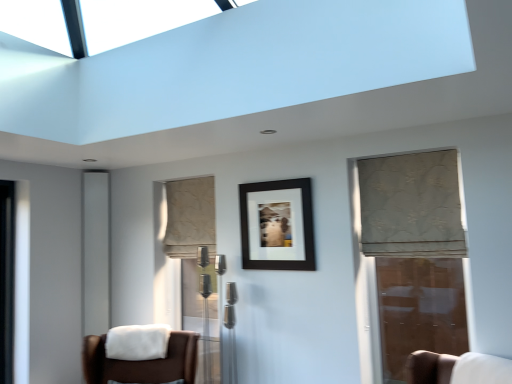
Question: Is white soft fabric at lower left positioned with its back to beige floral fabric curtain at right, arranged as the 1th curtain when viewed from the front?

Choices:
 (A) no
 (B) yes

Answer: (A)

Question: Considering the relative sizes of white soft fabric at lower left and beige floral fabric curtain at right, the second curtain in the left-to-right sequence, in the image provided, is white soft fabric at lower left bigger than beige floral fabric curtain at right, the second curtain in the left-to-right sequence,?

Choices:
 (A) yes
 (B) no

Answer: (B)

Question: Does white soft fabric at lower left have a lesser height compared to beige floral fabric curtain at right, arranged as the 1th curtain when viewed from the front?

Choices:
 (A) no
 (B) yes

Answer: (B)

Question: Could you tell me if white soft fabric at lower left is turned towards beige floral fabric curtain at right, positioned as the first curtain in right-to-left order?

Choices:
 (A) no
 (B) yes

Answer: (A)

Question: Is the depth of white soft fabric at lower left greater than that of beige floral fabric curtain at right, arranged as the 1th curtain when viewed from the front?

Choices:
 (A) no
 (B) yes

Answer: (B)

Question: From a real-world perspective, is white soft fabric at lower left on beige floral fabric curtain at right, the 2th curtain when ordered from back to front?

Choices:
 (A) yes
 (B) no

Answer: (B)

Question: From a real-world perspective, is brown leather chair at lower left, placed as the 1th chair when sorted from left to right, below transparent glass door at right?

Choices:
 (A) yes
 (B) no

Answer: (A)

Question: Can you confirm if brown leather chair at lower left, which ranks as the 2th chair in right-to-left order, is positioned to the right of transparent glass door at right?

Choices:
 (A) no
 (B) yes

Answer: (A)

Question: Does brown leather chair at lower left, which ranks as the 2th chair in right-to-left order, have a lesser height compared to transparent glass door at right?

Choices:
 (A) yes
 (B) no

Answer: (A)

Question: Does brown leather chair at lower left, placed as the 1th chair when sorted from left to right, have a smaller size compared to transparent glass door at right?

Choices:
 (A) no
 (B) yes

Answer: (A)

Question: Considering the relative sizes of brown leather chair at lower left, placed as the 1th chair when sorted from left to right, and transparent glass door at right in the image provided, is brown leather chair at lower left, placed as the 1th chair when sorted from left to right, taller than transparent glass door at right?

Choices:
 (A) no
 (B) yes

Answer: (A)

Question: Does brown leather chair at lower left, which ranks as the 2th chair in right-to-left order, have a greater width compared to transparent glass door at right?

Choices:
 (A) no
 (B) yes

Answer: (B)

Question: Could you tell me if transparent glass door at right is facing white fabric chair at lower right, which is counted as the 2th chair, starting from the left?

Choices:
 (A) no
 (B) yes

Answer: (B)